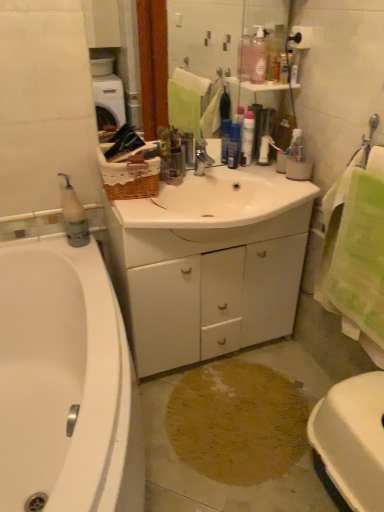
The image size is (384, 512). I want to click on vacant space that is to the left of white plastic bottle at left, which ranks as the 2th cleaning product in right-to-left order, so click(x=33, y=244).